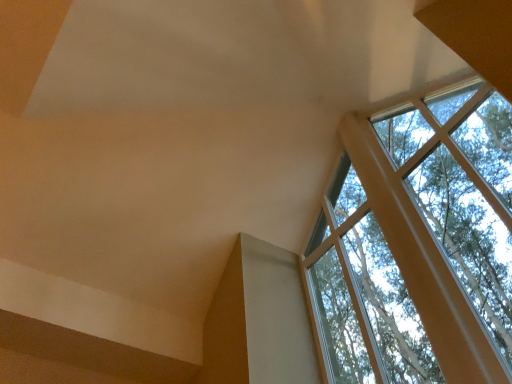
Measure the distance between point (473, 359) and camera.

Point (473, 359) is 1.97 meters away from camera.

What do you see at coordinates (417, 246) in the screenshot?
I see `clear glass window at upper right` at bounding box center [417, 246].

Find the location of a particular element. clear glass window at upper right is located at coordinates (417, 246).

At what (x,y) coordinates should I click in order to perform the action: click on clear glass window at upper right. Please return your answer as a coordinate pair (x, y). The width and height of the screenshot is (512, 384). Looking at the image, I should click on (417, 246).